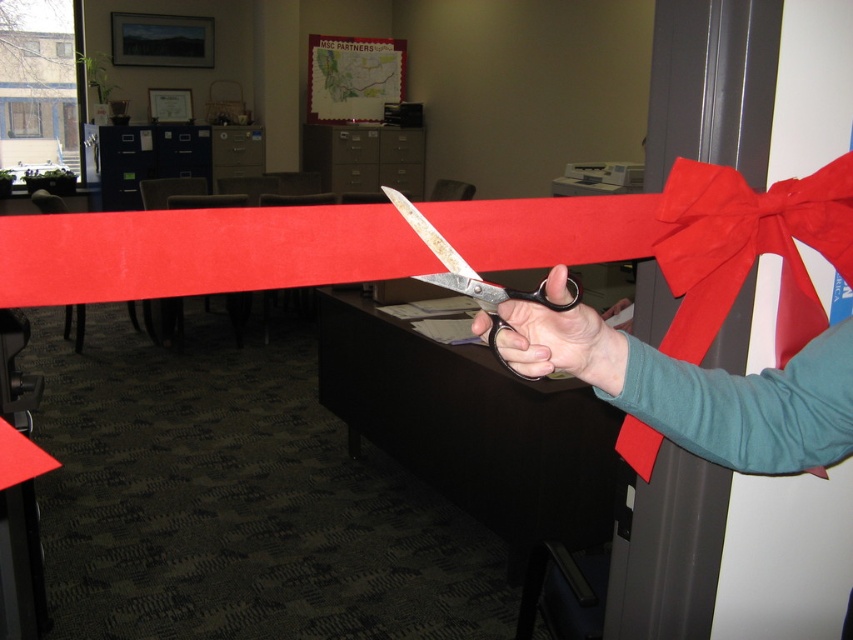
You are organizing a small event and need to choose between the metallic scissors at center and the matte black scissors at center to cut a ribbon. If the ribbon is 3 inches wide, which pair of scissors can you use without overlapping the other pair?

Both the metallic scissors at center and the matte black scissors at center are 2.70 inches apart. Since the ribbon is 3 inches wide, which is wider than the space between the scissors, you can use either pair without overlapping the other as long as they are positioned appropriately along the ribbon.

You are organizing a small event and need to choose between the matte black scissors at center and the metallic shears at center to cut a thick ribbon. Based on their sizes, which tool would be more suitable for the task?

The metallic shears at center are longer than the matte black scissors at center, making them more suitable for cutting thick ribbons.